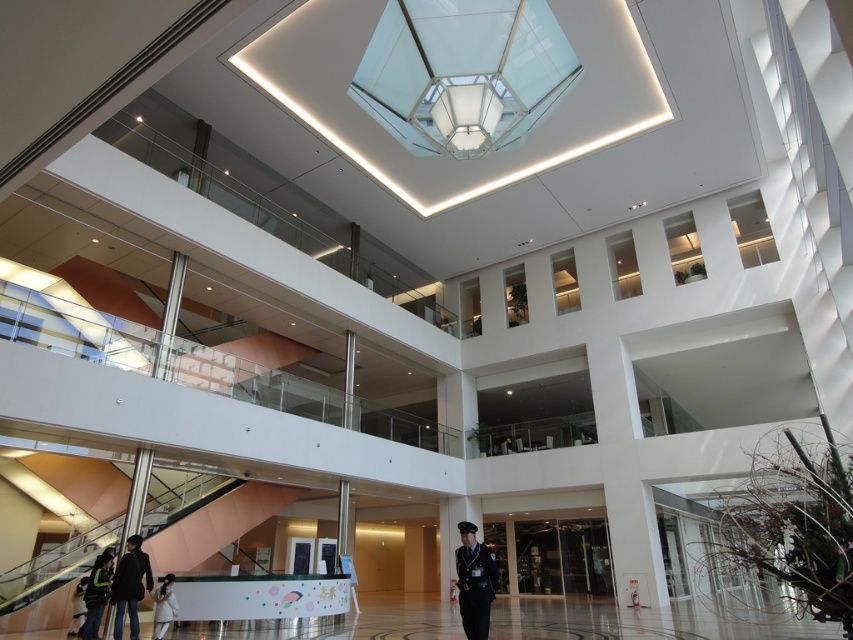
Question: Which point is closer to the camera?

Choices:
 (A) (160, 588)
 (B) (467, 540)

Answer: (B)

Question: Does uniformed officer at center appear on the right side of dark gray fabric jacket at lower left?

Choices:
 (A) no
 (B) yes

Answer: (B)

Question: Which of the following is the farthest from the observer?

Choices:
 (A) (90, 637)
 (B) (485, 616)
 (C) (74, 632)

Answer: (C)

Question: Can you confirm if green fabric jacket at lower left is positioned to the right of dark blue uniform at lower center?

Choices:
 (A) yes
 (B) no

Answer: (A)

Question: Estimate the real-world distances between objects in this image. Which object is farther from the white fuzzy coat at lower left?

Choices:
 (A) dark blue uniform at lower center
 (B) uniformed officer at center

Answer: (B)

Question: Does dark gray fabric jacket at lower left have a larger size compared to green fabric jacket at lower left?

Choices:
 (A) yes
 (B) no

Answer: (A)